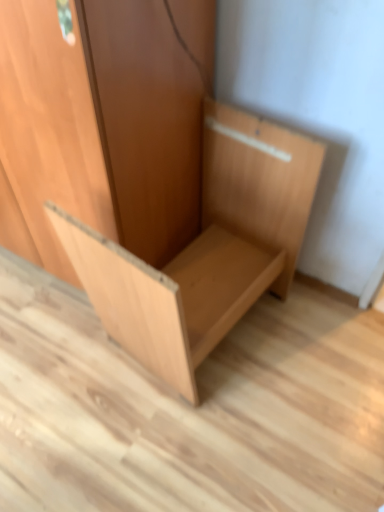
In order to face light brown wood chair at center, should I rotate leftwards or rightwards?

Turn right by 0.727 degrees to look at light brown wood chair at center.

Where is `light brown wood chair at center`? This screenshot has height=512, width=384. light brown wood chair at center is located at coordinates (146, 175).

Describe the element at coordinates (146, 175) in the screenshot. I see `light brown wood chair at center` at that location.

Identify the location of light brown wood chair at center. The image size is (384, 512). (146, 175).